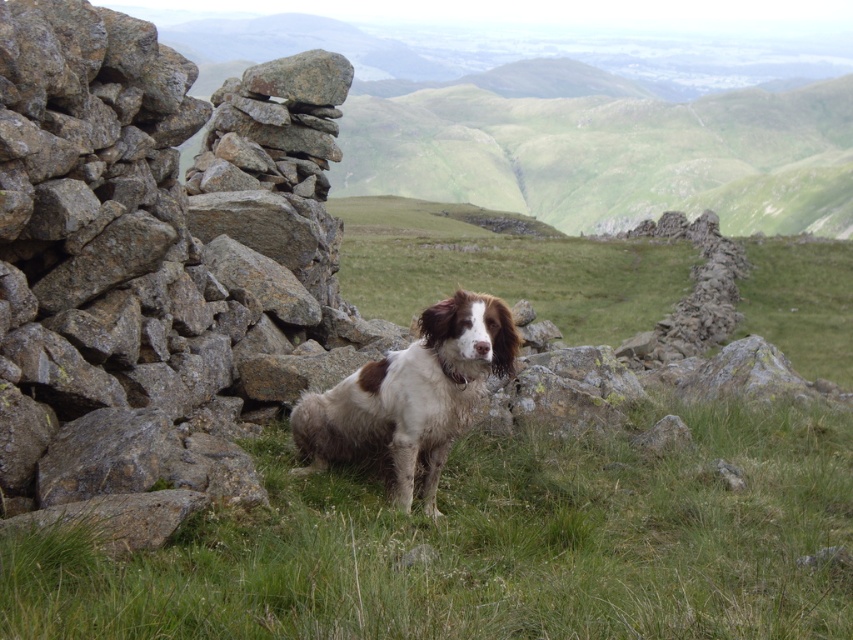
You are standing in the outdoor scene and want to throw a stick to the brown and white fur dog at center. The stick is currently near the rough gray rock at left. Which direction should you move to ensure the stick reaches the dog?

Since the rough gray rock at left is closer to the viewer than the brown and white fur dog at center, you should move forward towards the dog so the stick can reach it.

You are standing at the center of the image and want to walk towards the point marked as point (148, 268). Which direction should you go?

The point (148, 268) corresponds to the rough gray rock at left, so you should go to the left.

You are standing at the camera position and want to throw a ball to the dog. The ball is currently at your feet. The rough gray rock at left is 3.98 meters away from you. If the dog is between you and the rock, will the ball reach the dog before hitting the rock?

The distance between the rough gray rock at left and the camera is 3.98 meters. If the dog is between you and the rock, the ball will reach the dog before hitting the rock since the dog is closer than the rock.